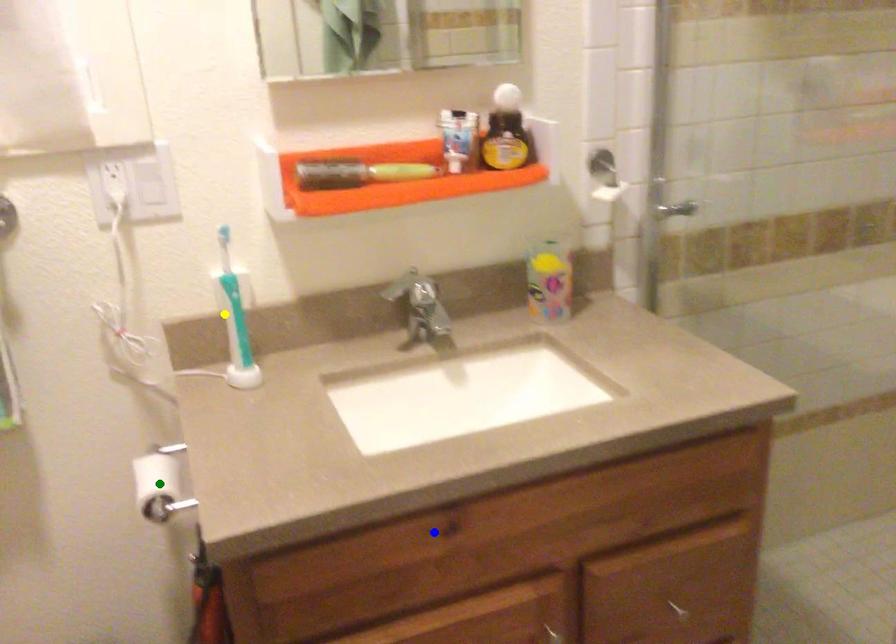
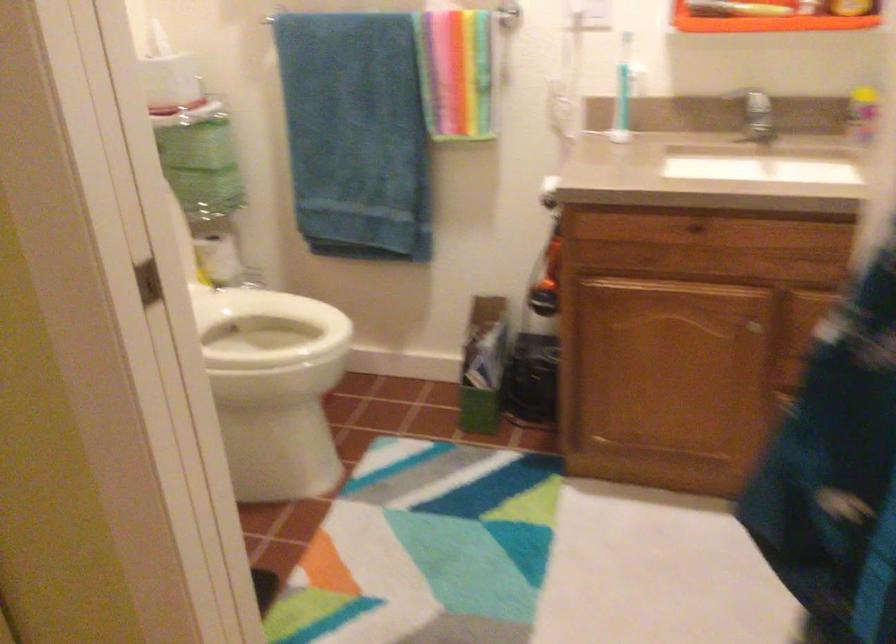
I am providing you with two images of the same scene from different viewpoints. Three points are marked in image1. Which point corresponds to a part or object that is occluded in image2?In image1, three points are marked. Which of them correspond to a part or object that is occluded in image2?Among the three points shown in image1, which one corresponds to a part or object that is no longer visible due to occlusion in image2?

green point cannot be seen in image2.